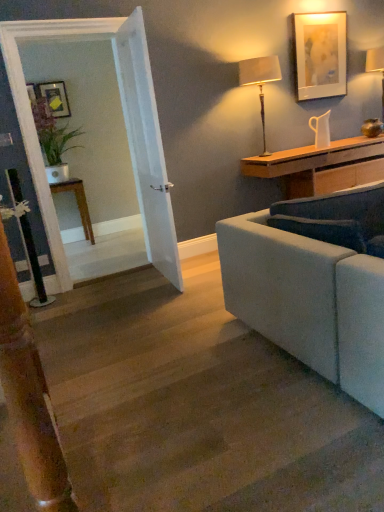
Find the location of a particular element. The image size is (384, 512). vacant space underneath clear glass door at left (from a real-world perspective) is located at coordinates (121, 273).